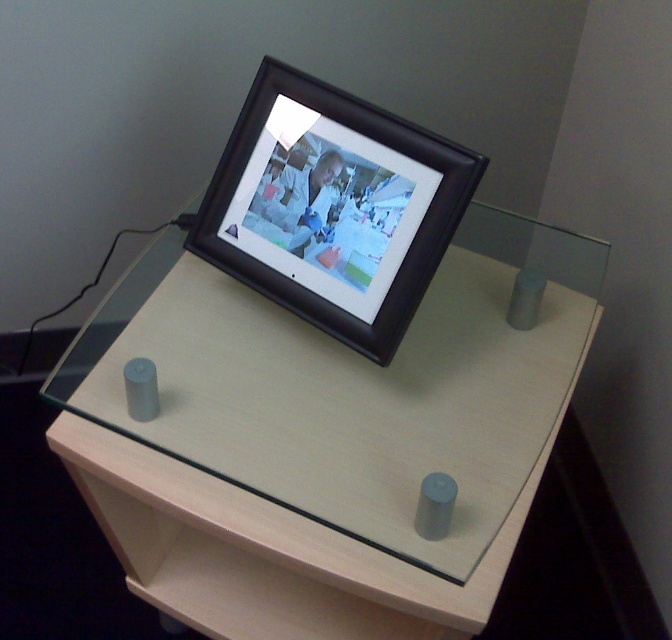
You are setting up a small plant pot that is 6 inches wide. You want to place it between the light wood computer desk at center and the black matte picture frame at center. Can the plant pot fit in the space between them?

The light wood computer desk at center and black matte picture frame at center are 6.68 inches apart. Since the plant pot is 6 inches wide, it can fit in the space between them as the distance is greater than the pot width.

You are standing in a room and want to place a 24 inch wide laptop on the light wood computer desk at center. Can you fit it on the desk without moving any existing items?

The light wood computer desk at center and viewer are 26.69 inches apart from each other. Since the desk is 26.69 inches away from you, the 24 inch wide laptop can be placed on the desk as it is narrower than the distance between you and the desk.

You are organizing a workspace and need to place a new monitor that requires 12 inches of vertical space. Given the light wood computer desk at center and the black matte picture frame at center, which object can accommodate the monitor without blocking the frame?

The light wood computer desk at center is much taller than the black matte picture frame at center, so the desk can accommodate the monitor without blocking the frame.